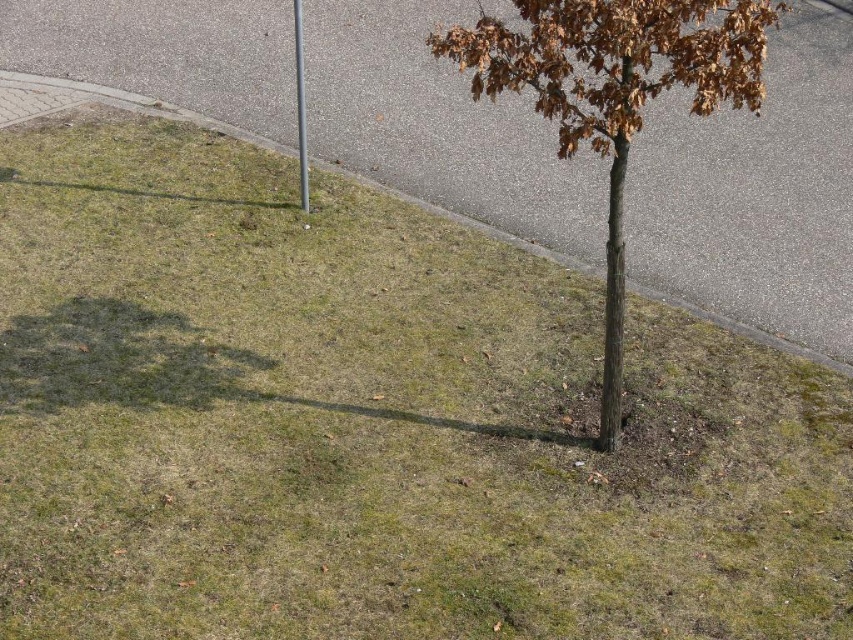
Looking at this image, you are a delivery driver approaching the gray asphalt curb at lower left and the silver metallic pole at center. Which object will you encounter first as you drive towards them?

The gray asphalt curb at lower left is in front of the silver metallic pole at center, so you will encounter the gray asphalt curb at lower left first.

You are a gardener trying to plant a new tree sapling that needs to be taller than the gray asphalt curb at lower left. Based on the image, can the brown rough bark tree at center be used as a reference for the minimum height required?

The brown rough bark tree at center is shorter than the gray asphalt curb at lower left, so it would not meet the required height. You need to choose a taller tree sapling.

You are standing at the edge of the grassy area near the road and want to walk towards the brown rough bark tree at center. Which direction should you walk relative to the silver metallic pole at center?

You should walk to the right of the silver metallic pole at center because the brown rough bark tree at center is located to the right of the silver metallic pole at center.